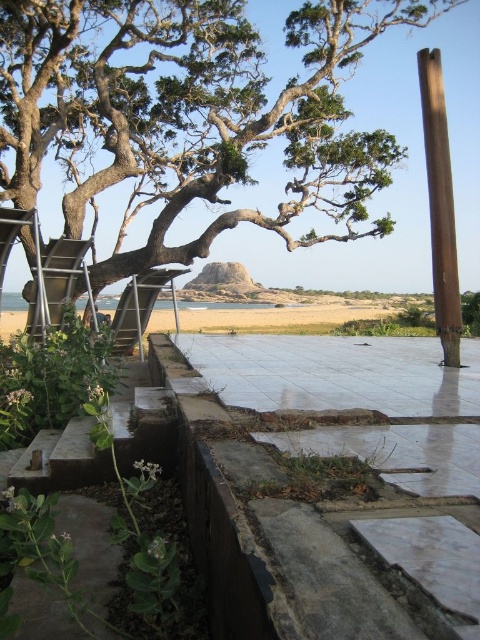
Between green leafy tree at upper left and metallic silver ladder at left, which one is positioned higher?

green leafy tree at upper left is higher up.

Is green leafy tree at upper left below metallic silver ladder at left?

No.

The width and height of the screenshot is (480, 640). In order to click on green leafy tree at upper left in this screenshot , I will do (x=192, y=113).

Is green leafy tree at upper left smaller than gray concrete at lower center?

No.

Identify the location of green leafy tree at upper left. (192, 113).

Is point (134, 93) positioned behind point (228, 554)?

Yes, it is.

Where is `green leafy tree at upper left`? Image resolution: width=480 pixels, height=640 pixels. green leafy tree at upper left is located at coordinates (192, 113).

Who is more distant from viewer, (x=397, y=476) or (x=54, y=307)?

Point (x=54, y=307)

The image size is (480, 640). I want to click on gray concrete at lower center, so click(x=324, y=513).

Locate an element on the screen. gray concrete at lower center is located at coordinates (324, 513).